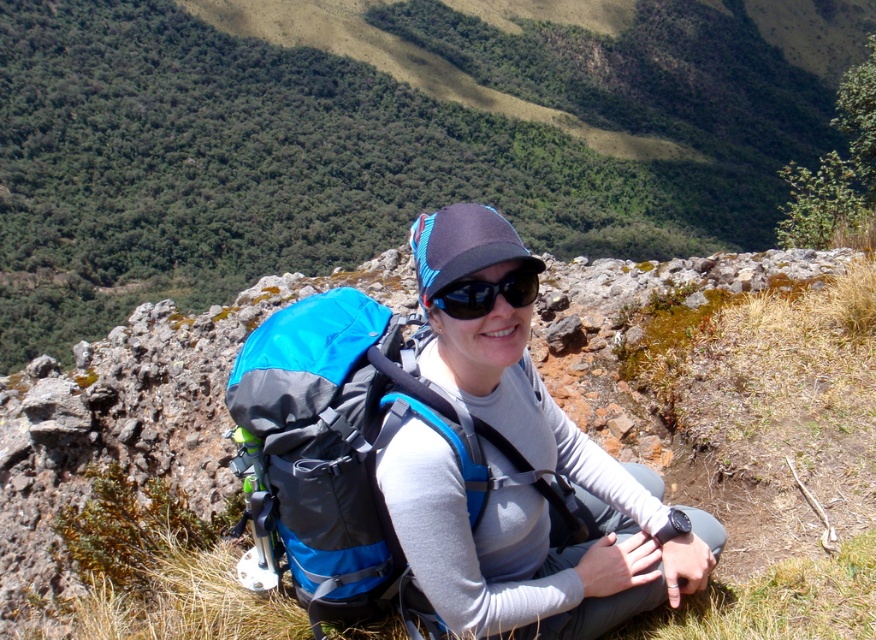
Question: Which point is closer to the camera taking this photo?

Choices:
 (A) (246, 429)
 (B) (449, 467)

Answer: (B)

Question: Among these points, which one is nearest to the camera?

Choices:
 (A) (274, 4)
 (B) (305, 321)
 (C) (503, 288)

Answer: (C)

Question: Is gray fabric backpack at center below blue fabric backpack at center?

Choices:
 (A) yes
 (B) no

Answer: (B)

Question: Can you confirm if green leafy hillside at upper center is positioned to the left of black reflective sunglasses at center?

Choices:
 (A) yes
 (B) no

Answer: (B)

Question: Which point appears closest to the camera in this image?

Choices:
 (A) (277, 428)
 (B) (492, 492)
 (C) (18, 84)
 (D) (528, 276)

Answer: (D)

Question: Does green leafy hillside at upper center come behind black reflective sunglasses at center?

Choices:
 (A) no
 (B) yes

Answer: (B)